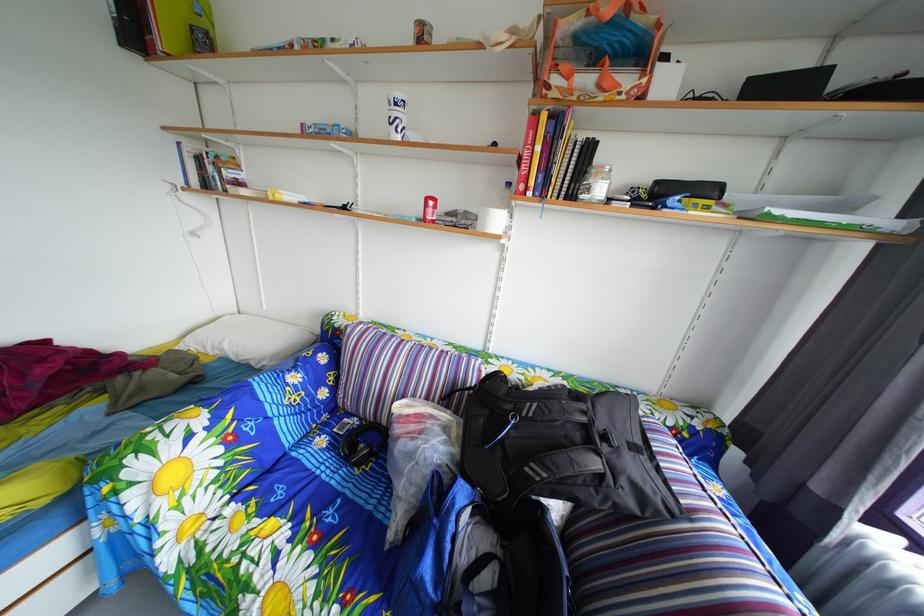
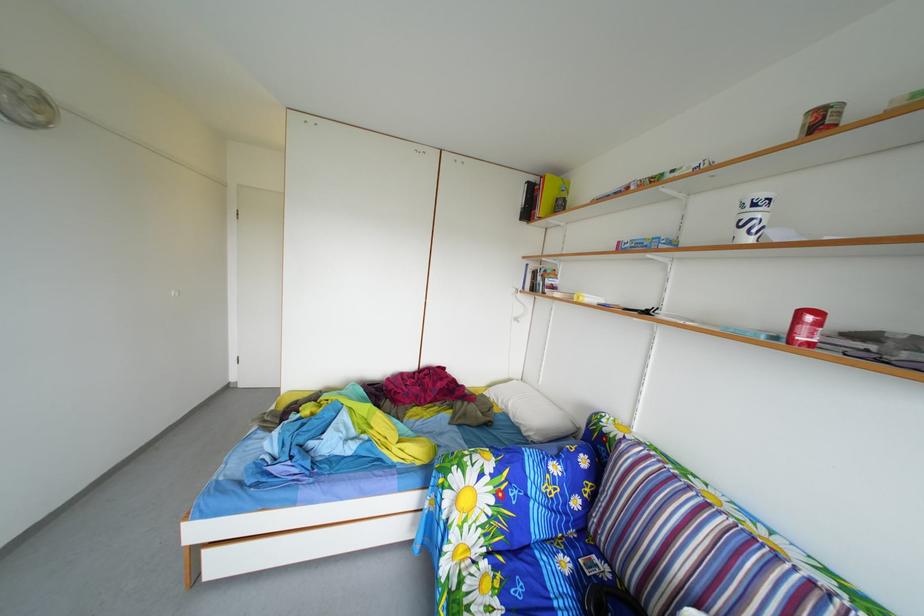
Find the pixel in the second image that matches [438,207] in the first image.

(811, 321)